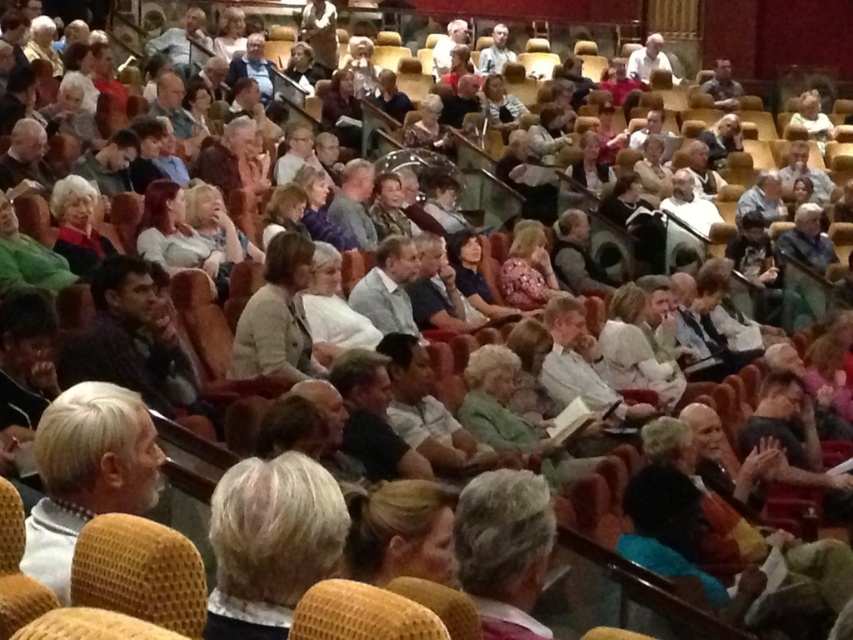
Question: Can you confirm if blonde hair at center is bigger than light beige fabric jacket at center?

Choices:
 (A) no
 (B) yes

Answer: (A)

Question: Considering the relative positions of blonde hair at center and light beige fabric jacket at center in the image provided, where is blonde hair at center located with respect to light beige fabric jacket at center?

Choices:
 (A) left
 (B) right

Answer: (B)

Question: Which point is farther to the camera?

Choices:
 (A) (299, 236)
 (B) (277, 628)

Answer: (A)

Question: Can you confirm if blonde hair at center is positioned below light beige fabric jacket at center?

Choices:
 (A) no
 (B) yes

Answer: (B)